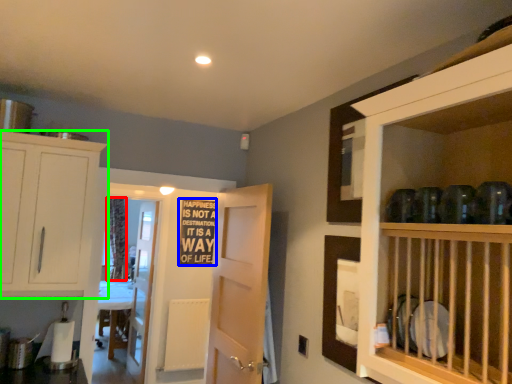
Question: Based on their relative distances, which object is farther from curtain (highlighted by a red box)? Choose from writing (highlighted by a blue box) and cabinetry (highlighted by a green box).

Choices:
 (A) writing
 (B) cabinetry

Answer: (B)